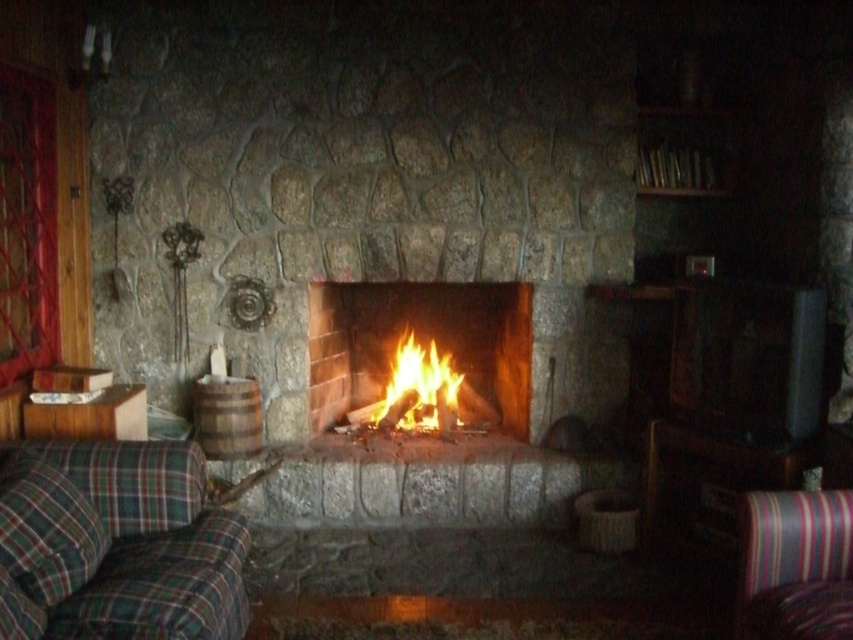
Question: Is striped fabric armchair at lower right smaller than flaming wood at center?

Choices:
 (A) no
 (B) yes

Answer: (B)

Question: Which of these objects is positioned farthest from the orange flame fire at center?

Choices:
 (A) striped fabric armchair at lower right
 (B) green plaid fabric couch at lower left
 (C) flaming wood at center

Answer: (A)

Question: Which point is closer to the camera?

Choices:
 (A) (757, 492)
 (B) (154, 612)
 (C) (463, 372)

Answer: (B)

Question: Is striped fabric armchair at lower right positioned before flaming wood at center?

Choices:
 (A) yes
 (B) no

Answer: (A)

Question: Can you confirm if striped fabric armchair at lower right is positioned to the left of flaming wood at center?

Choices:
 (A) no
 (B) yes

Answer: (A)

Question: Which is nearer to the orange flame fire at center?

Choices:
 (A) striped fabric armchair at lower right
 (B) green plaid fabric couch at lower left
 (C) flaming wood at center

Answer: (C)